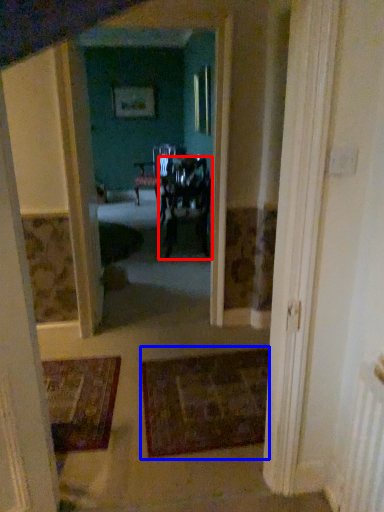
Question: Which of the following is the farthest to the observer, chair (highlighted by a red box) or doormat (highlighted by a blue box)?

Choices:
 (A) chair
 (B) doormat

Answer: (A)